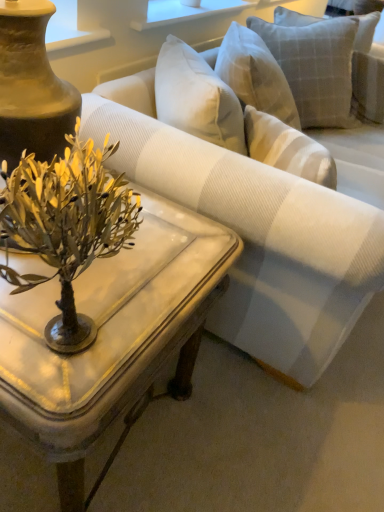
Measure the distance between white striped fabric couch at center and camera.

A: white striped fabric couch at center and camera are 35.72 inches apart.

Locate an element on the screen. white striped fabric couch at center is located at coordinates (298, 269).

At what (x,y) coordinates should I click in order to perform the action: click on light gray textured pillow at upper right. Please return your answer as a coordinate pair (x, y). Image resolution: width=384 pixels, height=512 pixels. Looking at the image, I should click on (314, 66).

The height and width of the screenshot is (512, 384). What are the coordinates of `white marble coffee table at center` in the screenshot? It's located at (112, 336).

Identify the location of metallic gold plant at center. This screenshot has width=384, height=512. (67, 226).

Which of these two, white striped fabric couch at center or white marble coffee table at center, is smaller?

white marble coffee table at center.

Does white striped fabric couch at center appear on the right side of white marble coffee table at center?

Correct, you'll find white striped fabric couch at center to the right of white marble coffee table at center.

The height and width of the screenshot is (512, 384). I want to click on studio couch behind the white marble coffee table at center, so click(x=298, y=269).

Measure the distance between white striped fabric couch at center and white marble coffee table at center.

They are 14.44 inches apart.

Considering the sizes of white marble coffee table at center and metallic gold plant at center in the image, is white marble coffee table at center bigger or smaller than metallic gold plant at center?

Considering their sizes, white marble coffee table at center takes up more space than metallic gold plant at center.

Which is behind, white marble coffee table at center or metallic gold plant at center?

Positioned behind is white marble coffee table at center.

Does white marble coffee table at center have a lesser width compared to metallic gold plant at center?

In fact, white marble coffee table at center might be wider than metallic gold plant at center.

Would you say white marble coffee table at center is a long distance from metallic gold plant at center?

Actually, white marble coffee table at center and metallic gold plant at center are a little close together.

Identify the location of coffee table below the light gray textured pillow at upper right (from the image's perspective). The image size is (384, 512). (112, 336).

From the image's perspective, is white marble coffee table at center positioned above or below light gray textured pillow at upper right?

From the image's perspective, white marble coffee table at center appears below light gray textured pillow at upper right.

Does white marble coffee table at center come in front of light gray textured pillow at upper right?

That is True.

Between point (297, 94) and point (64, 172), which one is positioned behind?

The point (297, 94) is farther from the camera.

In the scene shown: Does light gray textured pillow at upper right have a lesser width compared to metallic gold plant at center?

No.

Is point (310, 335) in front of point (12, 174)?

No.

Which object is positioned more to the right, white striped fabric couch at center or metallic gold plant at center?

Positioned to the right is white striped fabric couch at center.

Can metallic gold plant at center be found inside white striped fabric couch at center?

No.

Which object is wider, white striped fabric couch at center or metallic gold plant at center?

With larger width is white striped fabric couch at center.

Is light gray textured pillow at upper right taller or shorter than white striped fabric couch at center?

Considering their sizes, light gray textured pillow at upper right has less height than white striped fabric couch at center.

Is point (305, 89) positioned behind point (310, 316)?

Yes.

Which object is thinner, light gray textured pillow at upper right or white striped fabric couch at center?

With smaller width is light gray textured pillow at upper right.

Is white striped fabric couch at center located within white marble coffee table at center?

No, white marble coffee table at center does not contain white striped fabric couch at center.

From a real-world perspective, is white marble coffee table at center physically below white striped fabric couch at center?

Yes.

Can you tell me how much white marble coffee table at center and white striped fabric couch at center differ in facing direction?

They differ by 1.97 degrees in their facing directions.

Identify the location of coffee table on the left of white striped fabric couch at center. The width and height of the screenshot is (384, 512). (112, 336).

What are the coordinates of `flower in front of the white marble coffee table at center` in the screenshot? It's located at (67, 226).

From the image, which object appears to be farther from light gray textured pillow at upper right, metallic gold plant at center or white striped fabric couch at center?

The object further to light gray textured pillow at upper right is metallic gold plant at center.

Looking at the image, which one is located further to white striped fabric couch at center, metallic gold plant at center or white marble coffee table at center?

metallic gold plant at center is further to white striped fabric couch at center.

From the image, which object appears to be farther from metallic gold plant at center, white marble coffee table at center or light gray textured pillow at upper right?

light gray textured pillow at upper right is positioned further to the anchor metallic gold plant at center.

Considering their positions, is white marble coffee table at center positioned further to light gray textured pillow at upper right than white striped fabric couch at center?

Among the two, white marble coffee table at center is located further to light gray textured pillow at upper right.

Which object lies further to the anchor point white marble coffee table at center, light gray textured pillow at upper right or white striped fabric couch at center?

Based on the image, light gray textured pillow at upper right appears to be further to white marble coffee table at center.

From the image, which object appears to be nearer to metallic gold plant at center, light gray textured pillow at upper right or white marble coffee table at center?

white marble coffee table at center.

Estimate the real-world distances between objects in this image. Which object is further from light gray textured pillow at upper right, white marble coffee table at center or metallic gold plant at center?

The object further to light gray textured pillow at upper right is metallic gold plant at center.

In the scene shown: Which object lies further to the anchor point light gray textured pillow at upper right, white striped fabric couch at center or white marble coffee table at center?

white marble coffee table at center.

You are a GUI agent. You are given a task and a screenshot of the screen. Output one action in this format:
    pyautogui.click(x=<x>, y=<y>)
    Task: Click on the studio couch between light gray textured pillow at upper right and white marble coffee table at center from top to bottom
    The height and width of the screenshot is (512, 384).
    Given the screenshot: What is the action you would take?
    pyautogui.click(x=298, y=269)

Find the location of a particular element. coffee table between metallic gold plant at center and light gray textured pillow at upper right along the z-axis is located at coordinates (112, 336).

Where is `flower between white marble coffee table at center and white striped fabric couch at center`? The image size is (384, 512). flower between white marble coffee table at center and white striped fabric couch at center is located at coordinates (67, 226).

You are a GUI agent. You are given a task and a screenshot of the screen. Output one action in this format:
    pyautogui.click(x=<x>, y=<y>)
    Task: Click on the studio couch between metallic gold plant at center and light gray textured pillow at upper right from front to back
    The image size is (384, 512).
    Given the screenshot: What is the action you would take?
    pyautogui.click(x=298, y=269)